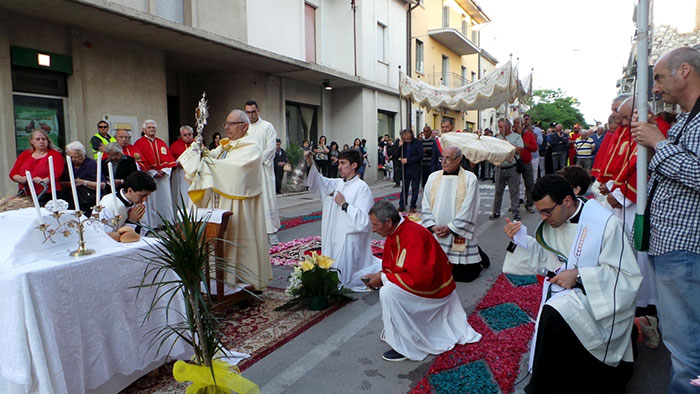
Locate an element on the screen. This screenshot has height=394, width=700. candle is located at coordinates (74, 189).